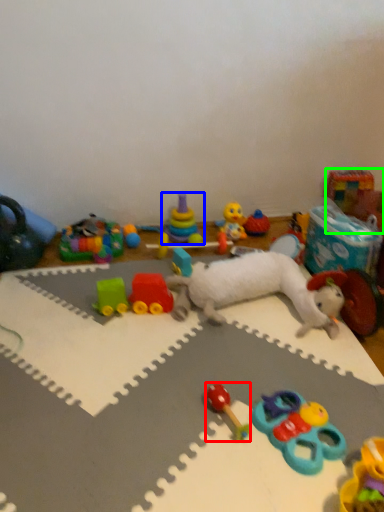
Question: Which object is the closest to the toy (highlighted by a red box)? Choose among these: toy (highlighted by a blue box) or toy (highlighted by a green box).

Choices:
 (A) toy
 (B) toy

Answer: (A)